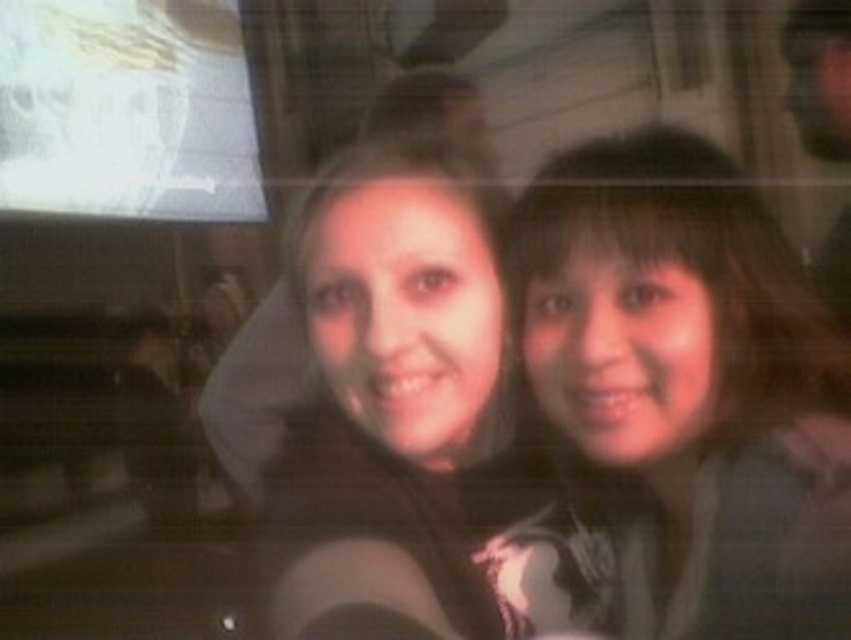
You are a photographer trying to capture a group photo of the two people in the selfie. The camera you have can only focus on objects within a 75 cm range. Can you take a clear photo of both the smooth brown hair at right and the other person?

The two people are 74.94 centimeters apart, which is within the camera focus range of 75 cm. Therefore, you can take a clear photo of both the smooth brown hair at right and the other person.

Looking at this image, you are a photographer trying to capture a close detail shot of the smooth brown hair at right and the smooth brown hair at upper right in the image. Since the camera has a limited focus range, you need to know which hair strand is wider to adjust the focus properly. Which one has a greater width?

The smooth brown hair at right has a greater width than the smooth brown hair at upper right, so you should focus on the smooth brown hair at right to adjust the focus properly.

You are a photographer trying to capture a clear shot of both smooth brown hair at right and smooth brown hair at upper right in the selfie. Which one is nearer to the camera?

The smooth brown hair at right is closer to the viewer than the smooth brown hair at upper right, so it is nearer to the camera.